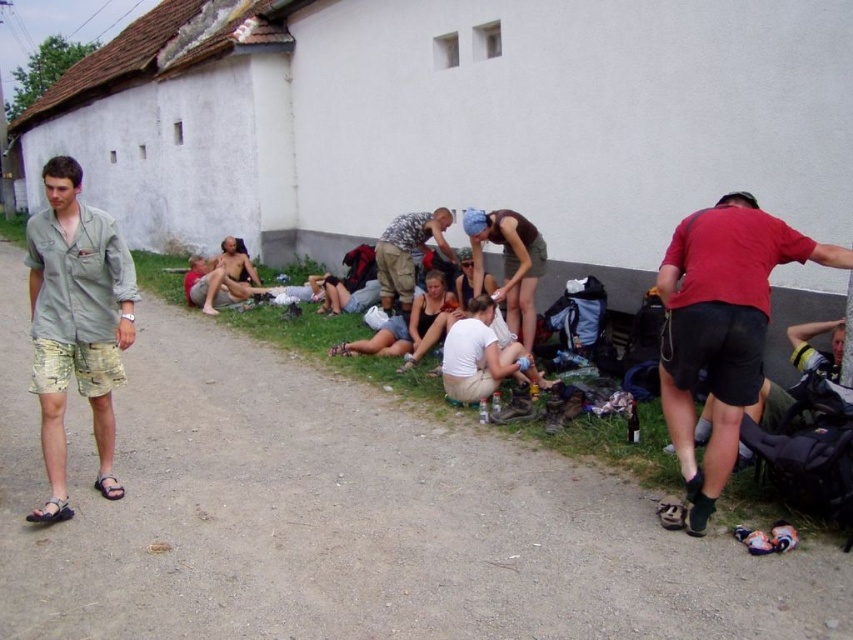
Question: Which object appears farthest from the camera in this image?

Choices:
 (A) red matte shirt at lower right
 (B) brown leather sandal at lower left
 (C) black leather sandal at lower left
 (D) light green cotton shirt at left

Answer: (B)

Question: Is light green cotton shirt at left below camouflage fabric shirt at center?

Choices:
 (A) yes
 (B) no

Answer: (A)

Question: Is brown fabric shirt at center wider than black leather sandal at lower left?

Choices:
 (A) no
 (B) yes

Answer: (B)

Question: Which point is farther to the camera?

Choices:
 (A) brown leather sandal at lower left
 (B) light green cotton shirt at left

Answer: (A)

Question: Is red matte shirt at lower right below light green cotton shirt at left?

Choices:
 (A) yes
 (B) no

Answer: (A)

Question: Which is farther from the black leather sandal at lower left?

Choices:
 (A) red matte shirt at lower right
 (B) brown leather sandal at lower left

Answer: (A)